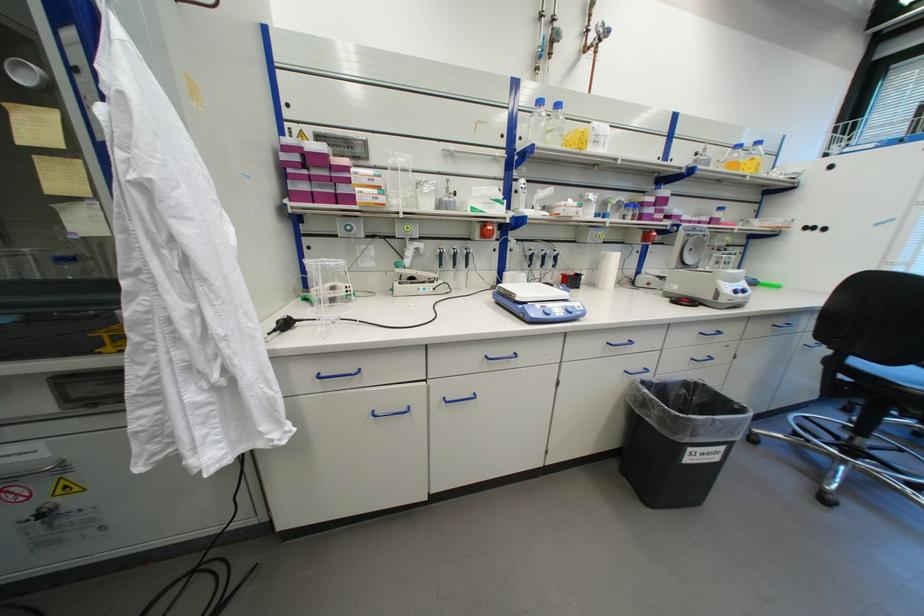
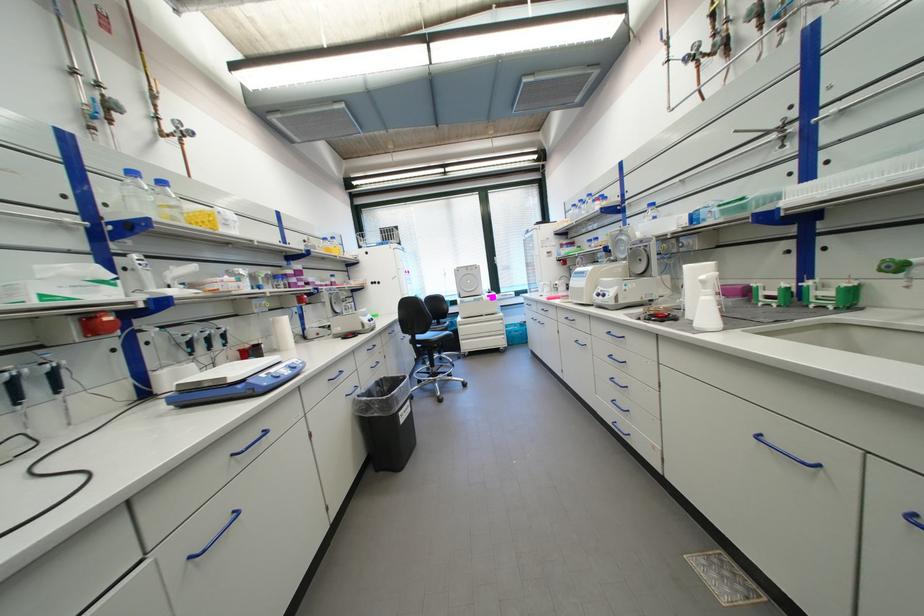
Locate, in the second image, the point that corresponds to (866,363) in the first image.

(427, 338)